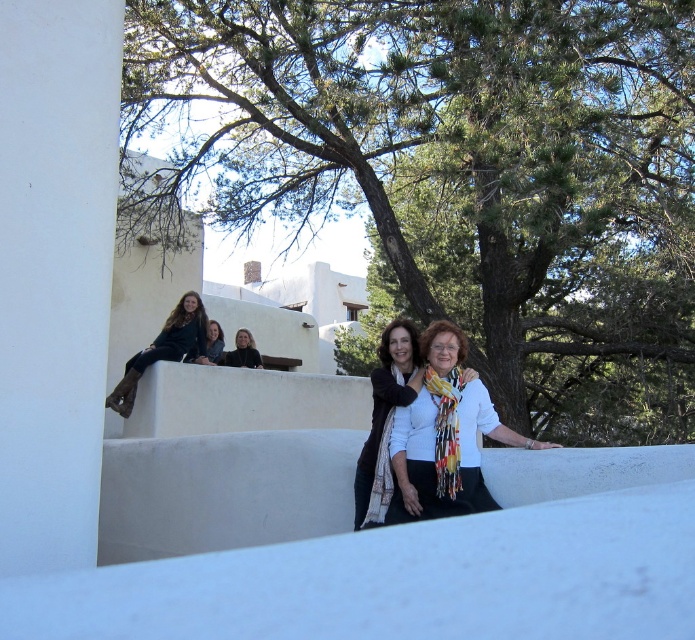
You are a photographer trying to capture a photo of the white scarf at center without the green leafy tree at upper center blocking it. Can you adjust your camera angle to achieve this?

The green leafy tree at upper center might be wider than the white scarf at center, so adjusting the camera angle might be necessary to avoid the tree blocking the scarf.

You are standing in the scene and want to take a photo of the green leafy tree at upper center. Which direction should you face to capture it in your camera view?

The green leafy tree at upper center is located at point (459, 173), so you should face towards the upper center direction to capture it in your camera view.

You are a photographer trying to capture a photo of the white scarf at center and the dark brown leather boots at upper left. Based on their heights, which object should you focus on first if you want to ensure both are in frame without adjusting your camera angle?

The white scarf at center is shorter than the dark brown leather boots at upper left. To include both in the frame without adjusting the camera angle, focus on the taller dark brown leather boots at upper left first, then adjust to include the shorter white scarf at center.